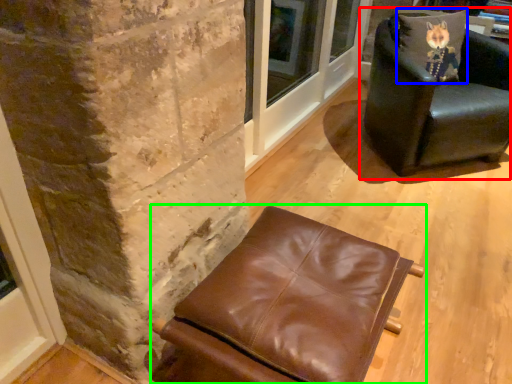
Question: Which object is the closest to the chair (highlighted by a red box)? Choose among these: pillow (highlighted by a blue box) or chair (highlighted by a green box).

Choices:
 (A) pillow
 (B) chair

Answer: (A)